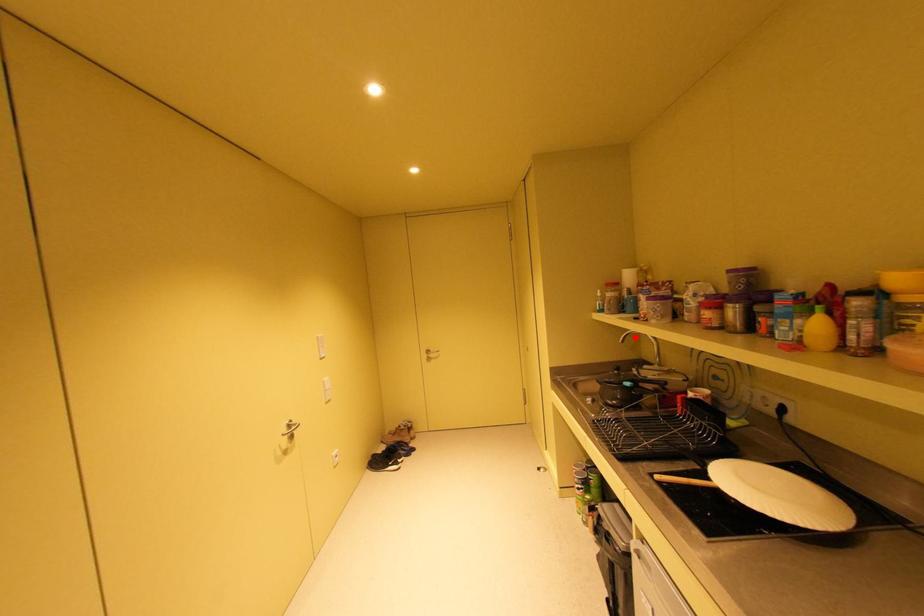
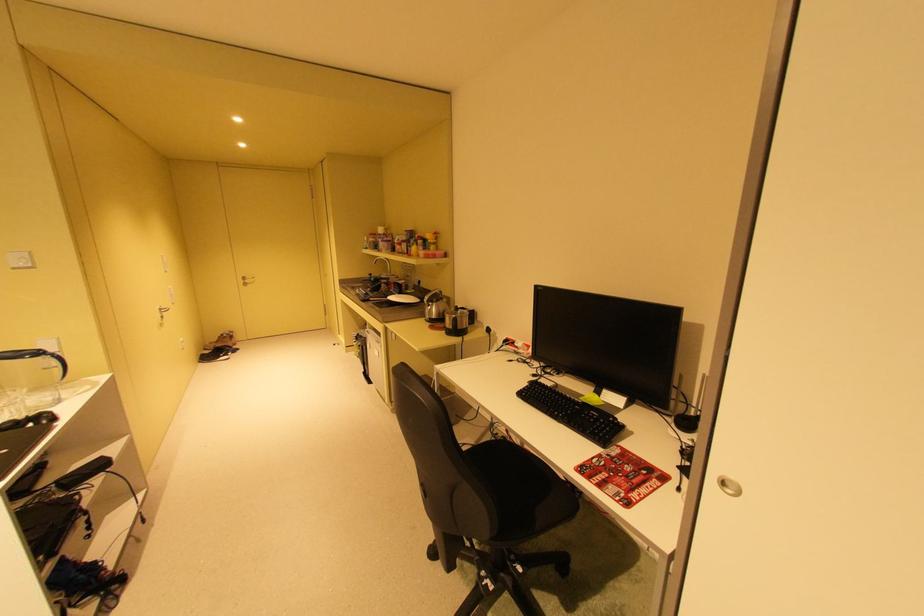
Locate, in the second image, the point that corresponds to the highlighted location in the first image.

(385, 262)